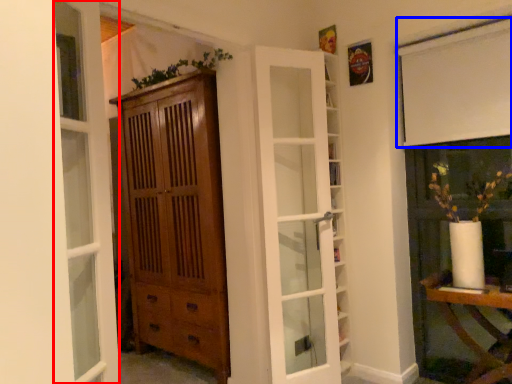
Question: Which point is closer to the camera, window (highlighted by a red box) or curtain (highlighted by a blue box)?

Choices:
 (A) window
 (B) curtain

Answer: (A)